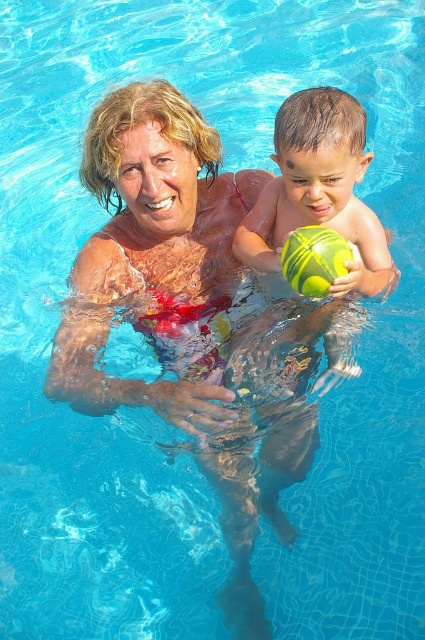
Looking at this image, you are standing at the edge of the swimming pool and see two points marked in the scene. Which point, point (314, 150) or point (308, 296), is closer to you?

Point (314, 150) is closer to the viewer than point (308, 296).

In the scene shown: You are a lifeguard standing at the edge of the pool. You need to retrieve the green rubber ball at center. Based on its coordinates, in which direction should you swim to reach it?

The green rubber ball at center is located at coordinates point (319, 189). Since the coordinate system is normalized, the ball is positioned slightly to the left and lower half of the pool. You should swim towards the lower left direction to reach it.